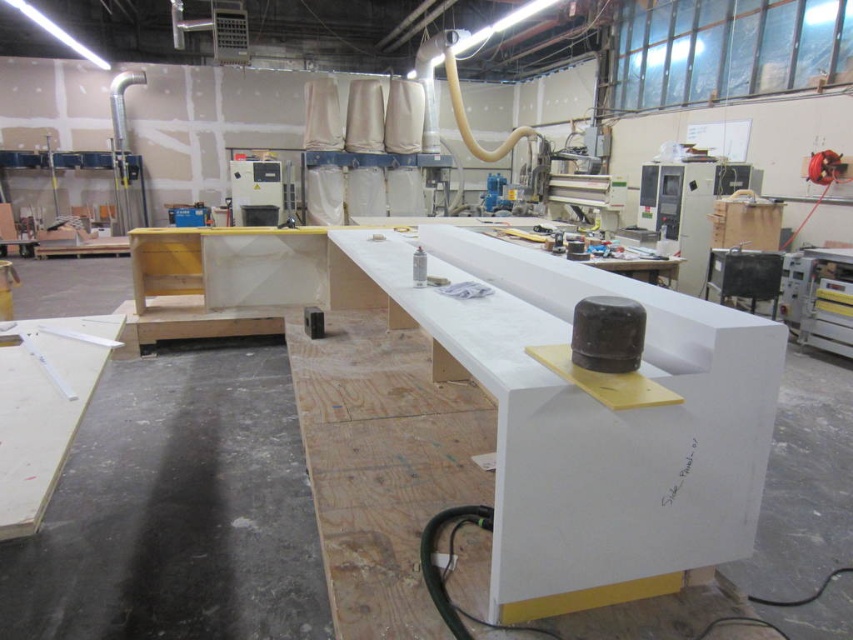
Question: Which of the following is the closest to the observer?

Choices:
 (A) white matte wood table at lower left
 (B) white matte table at center

Answer: (B)

Question: In this image, where is white matte table at center located relative to white matte wood table at lower left?

Choices:
 (A) above
 (B) below

Answer: (A)

Question: From the image, what is the correct spatial relationship of white matte table at center in relation to white matte wood table at lower left?

Choices:
 (A) above
 (B) below

Answer: (A)

Question: Is white matte table at center bigger than white matte wood table at lower left?

Choices:
 (A) yes
 (B) no

Answer: (A)